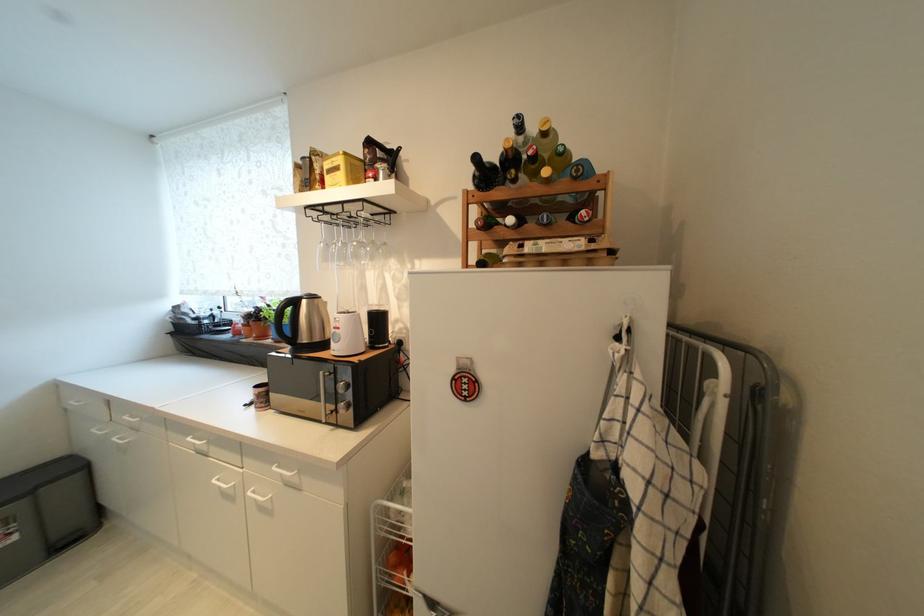
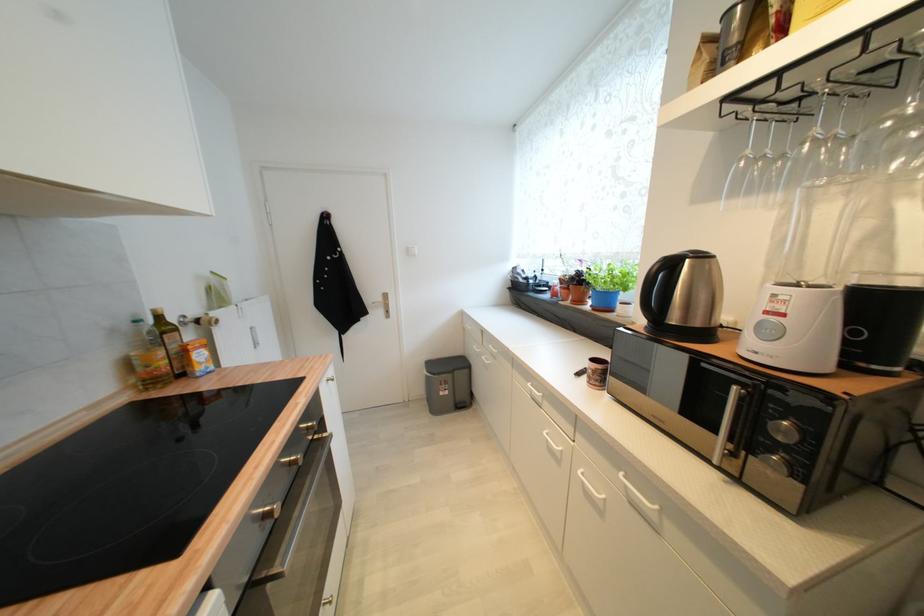
Question: Based on the continuous images, in which direction is the camera rotating? Reply with the corresponding letter.

Choices:
 (A) Left
 (B) Right
 (C) Up
 (D) Down

Answer: (A)